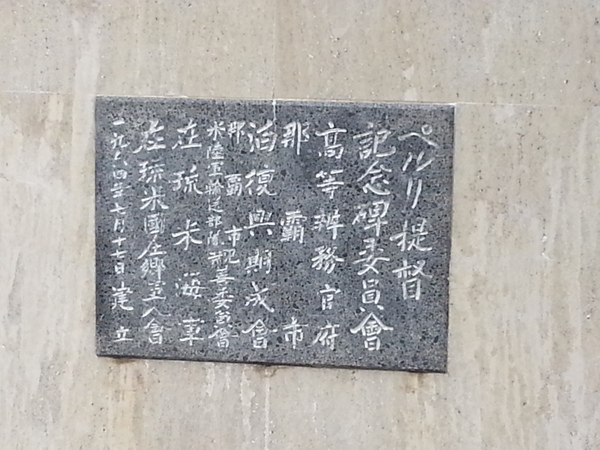
Identify the location of vertical grout line above artwork. The width and height of the screenshot is (600, 450). (272, 58).